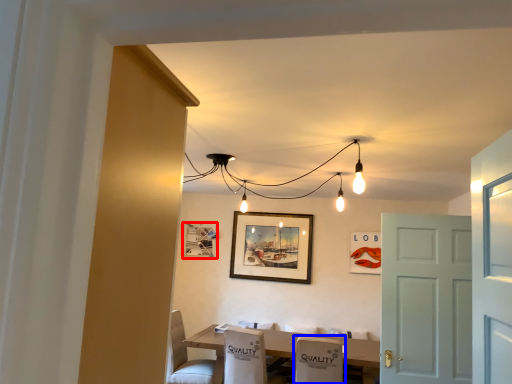
Question: Which point is further to the camera, picture frame (highlighted by a red box) or armchair (highlighted by a blue box)?

Choices:
 (A) picture frame
 (B) armchair

Answer: (A)